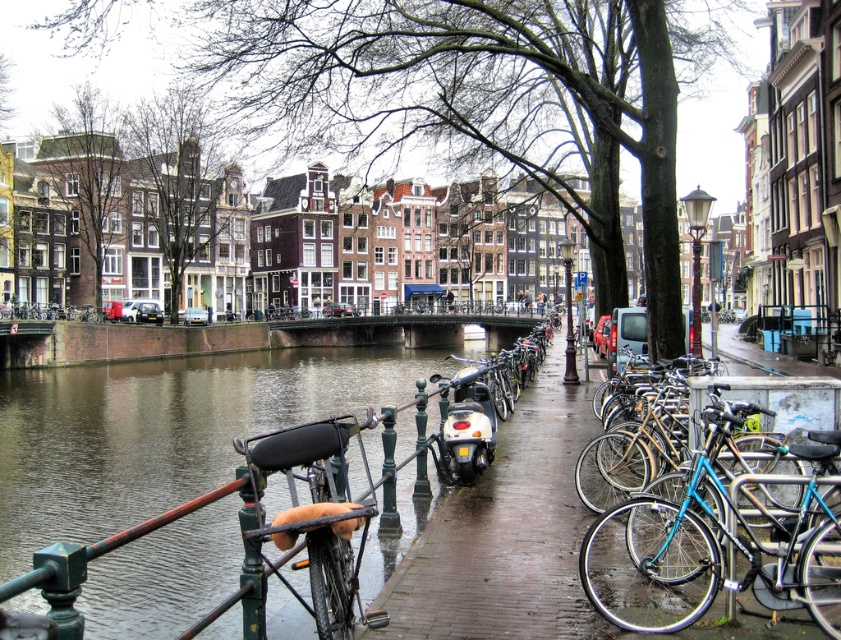
Is brick pavement at center shorter than blue metallic bicycle at right?

Incorrect, brick pavement at center's height does not fall short of blue metallic bicycle at right's.

Is point (463, 630) closer to camera compared to point (715, 547)?

No, it is not.

This screenshot has width=841, height=640. I want to click on brick pavement at center, so click(506, 532).